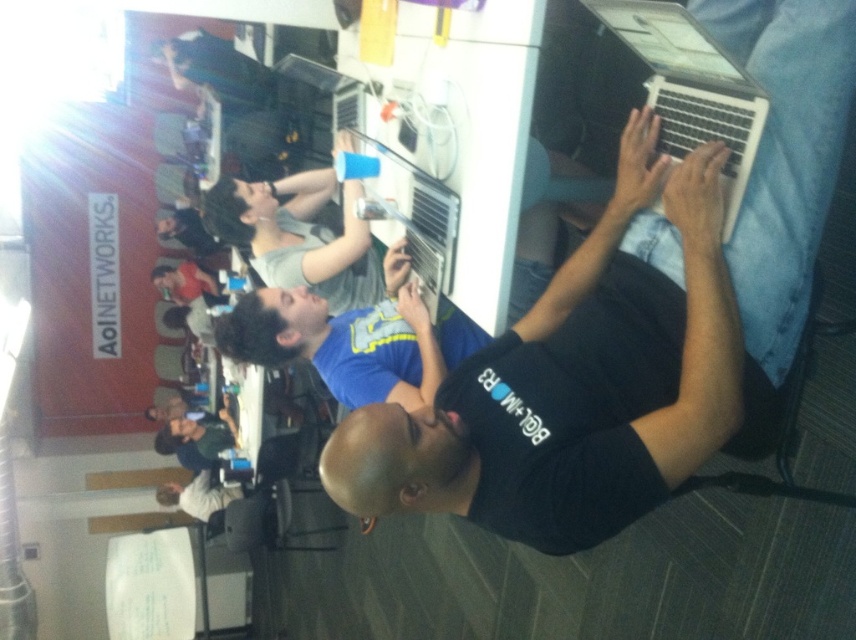
Question: Which object appears closest to the camera in this image?

Choices:
 (A) gray matte shirt at upper center
 (B) silver metallic laptop at upper right

Answer: (B)

Question: Observing the image, what is the correct spatial positioning of gray matte shirt at upper center in reference to matte black shirt at upper center?

Choices:
 (A) above
 (B) below

Answer: (A)

Question: Is silver metallic laptop at upper right further to the viewer compared to dark gray shirt at upper center?

Choices:
 (A) yes
 (B) no

Answer: (B)

Question: Does silver metallic laptop at upper right come in front of gray matte shirt at upper center?

Choices:
 (A) yes
 (B) no

Answer: (A)

Question: Which point is farther to the camera?

Choices:
 (A) gray matte shirt at upper center
 (B) matte black shirt at upper center
 (C) dark gray shirt at upper center
 (D) black matte laptop at center

Answer: (C)

Question: Which object is the farthest from the gray matte shirt at upper center?

Choices:
 (A) silver metallic laptop at upper right
 (B) matte black shirt at upper center
 (C) dark gray shirt at upper center
 (D) black matte laptop at center

Answer: (C)